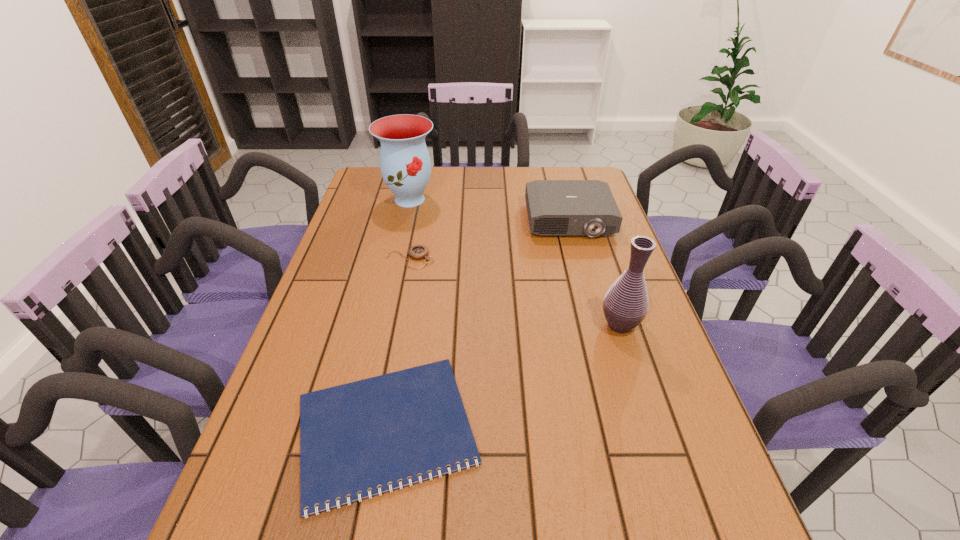
Identify the location of the farther vase. Image resolution: width=960 pixels, height=540 pixels. click(405, 164).

The image size is (960, 540). Identify the location of the nearer vase. (625, 306).

Locate an element on the screen. Image resolution: width=960 pixels, height=540 pixels. the right vase is located at coordinates (625, 306).

Locate an element on the screen. the third tallest object is located at coordinates [x=555, y=207].

This screenshot has width=960, height=540. Find the location of `the second shortest object`. the second shortest object is located at coordinates (417, 252).

The image size is (960, 540). I want to click on the third farthest object, so click(x=417, y=252).

The width and height of the screenshot is (960, 540). Identify the location of notepad. (359, 436).

Identify the location of the nearest object. The height and width of the screenshot is (540, 960). (359, 436).

Where is `blank area located 0.230m on the right of the left vase`? This screenshot has height=540, width=960. blank area located 0.230m on the right of the left vase is located at coordinates (501, 199).

Where is `free space located on the front of the fourth farthest object`? This screenshot has width=960, height=540. free space located on the front of the fourth farthest object is located at coordinates (632, 363).